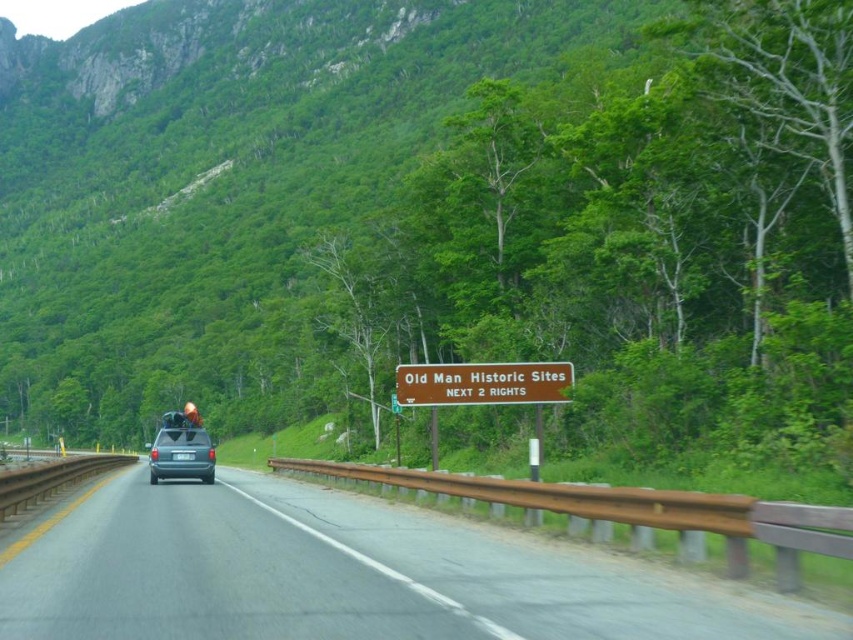
Question: Among these objects, which one is nearest to the camera?

Choices:
 (A) brown wooden sign at center
 (B) gray asphalt highway at center

Answer: (B)

Question: Is brown wooden sign at center below matte gray van at center?

Choices:
 (A) no
 (B) yes

Answer: (A)

Question: Does brown wooden sign at center come behind matte gray van at center?

Choices:
 (A) no
 (B) yes

Answer: (B)

Question: Can you confirm if brown wooden sign at center is smaller than matte gray van at center?

Choices:
 (A) yes
 (B) no

Answer: (A)

Question: Which object appears closest to the camera in this image?

Choices:
 (A) gray asphalt highway at center
 (B) brown wooden sign at center
 (C) matte gray van at center

Answer: (A)

Question: Which object is the closest to the brown wooden sign at center?

Choices:
 (A) matte gray van at center
 (B) gray asphalt highway at center

Answer: (A)